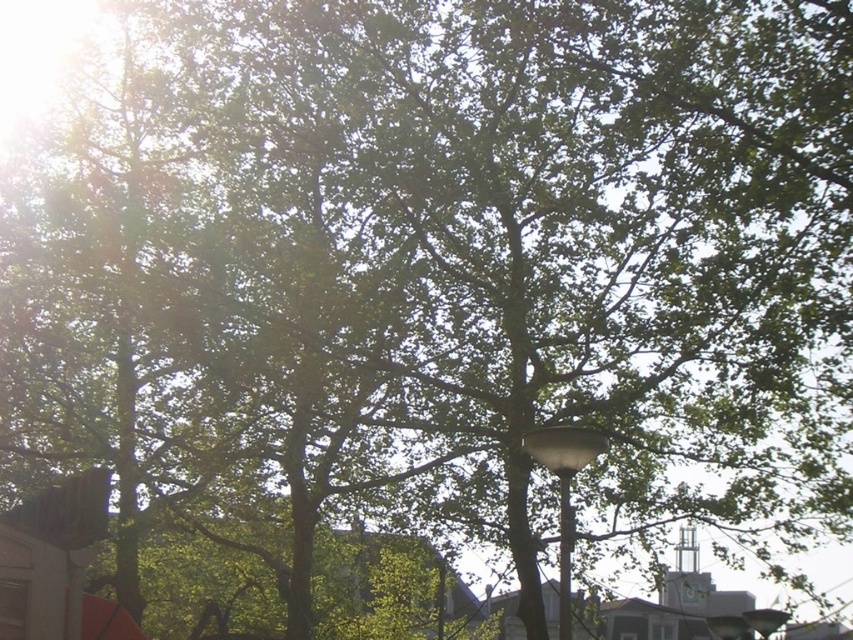
Is green leafy tree at center smaller than white glossy lamp post at center?

No.

Who is shorter, green leafy tree at center or white glossy lamp post at center?

white glossy lamp post at center is shorter.

Is point (485, 632) more distant than point (567, 557)?

That is True.

Where is `green leafy tree at center`? This screenshot has height=640, width=853. green leafy tree at center is located at coordinates (387, 589).